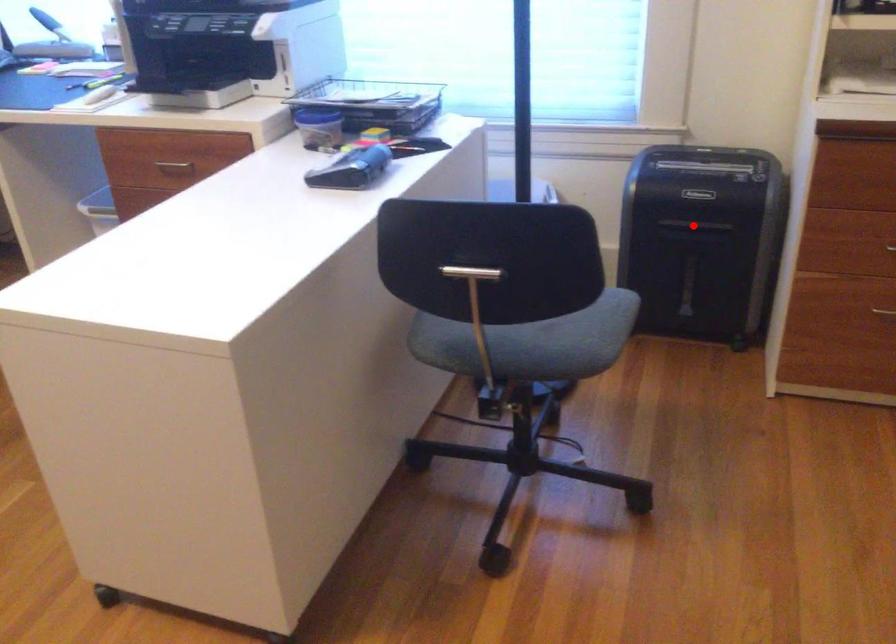
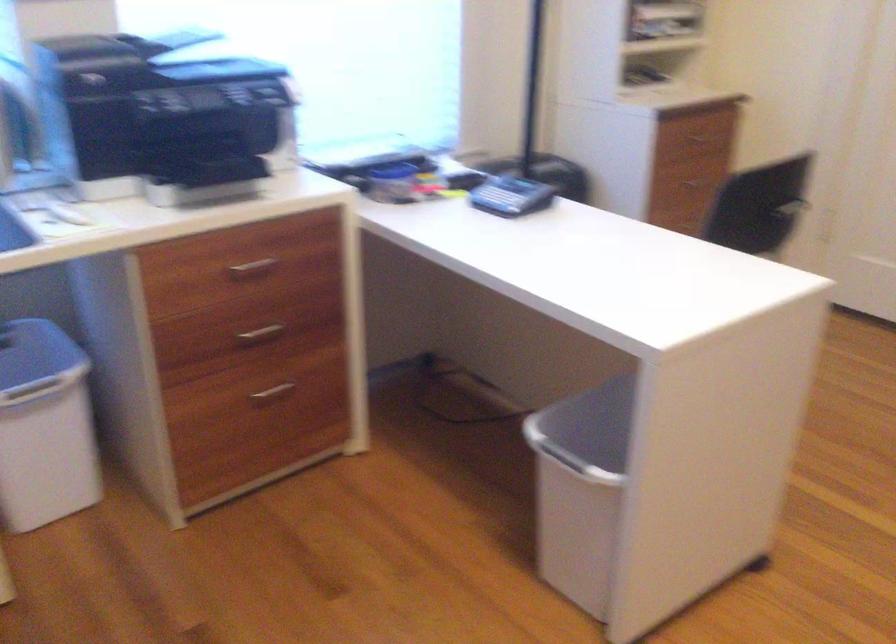
Question: I am providing you with two images of the same scene from different viewpoints. A red point is marked on the first image. Can you still see the location of the red point in image 2?

Choices:
 (A) Yes
 (B) No

Answer: (B)